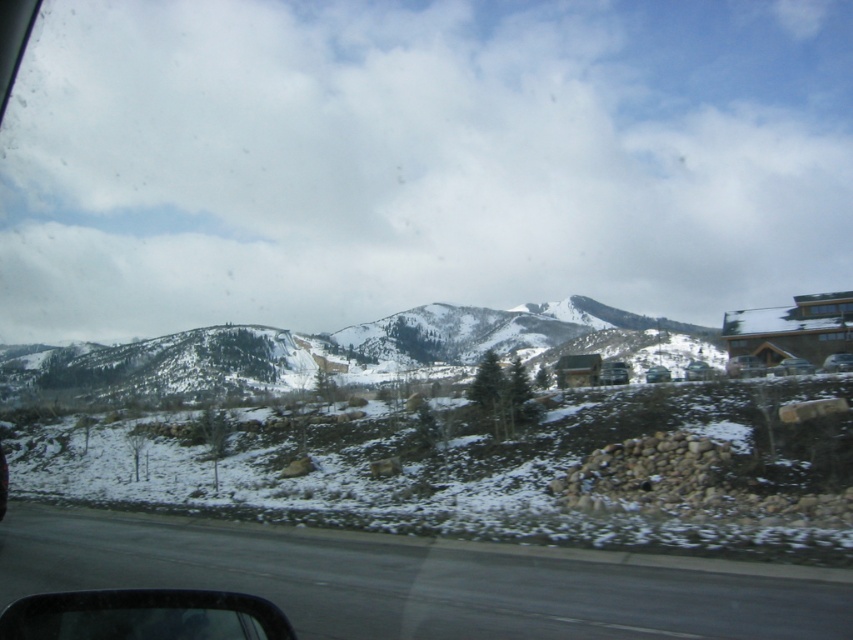
You are a passenger in the car and want to see the view outside. Which object, the transparent glass car window at lower left or the matte silver car at right, would allow you to look outside the vehicle?

The transparent glass car window at lower left allows you to look outside the vehicle since it is made of transparent glass, unlike the matte silver car at right which is part of the car structure and opaque.

You are a passenger in the car and want to see the road ahead through the transparent glass car window at lower left and the metallic gray car at lower left. Which object allows you to see the road better?

The transparent glass car window at lower left allows you to see the road better because it is thinner than the metallic gray car at lower left, making it more transparent.